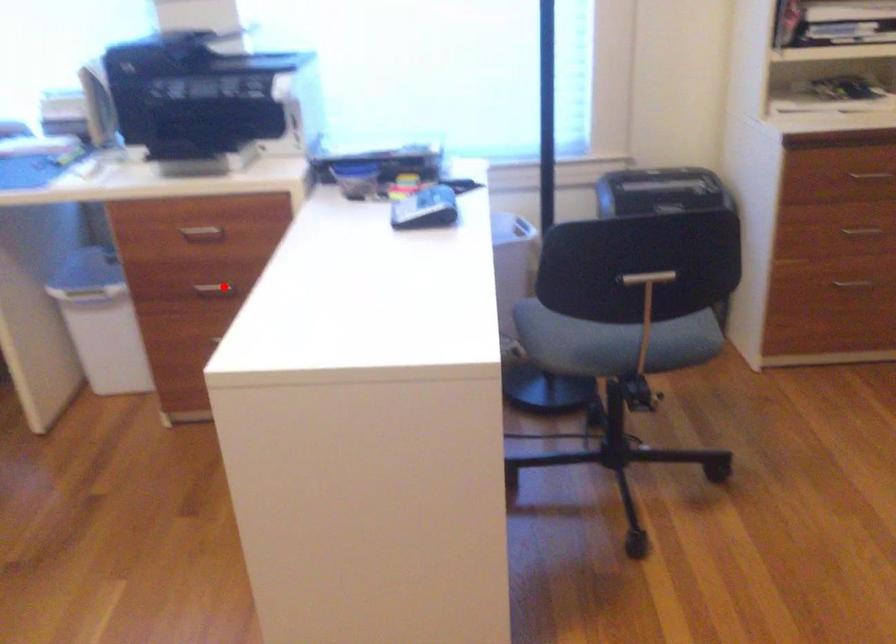
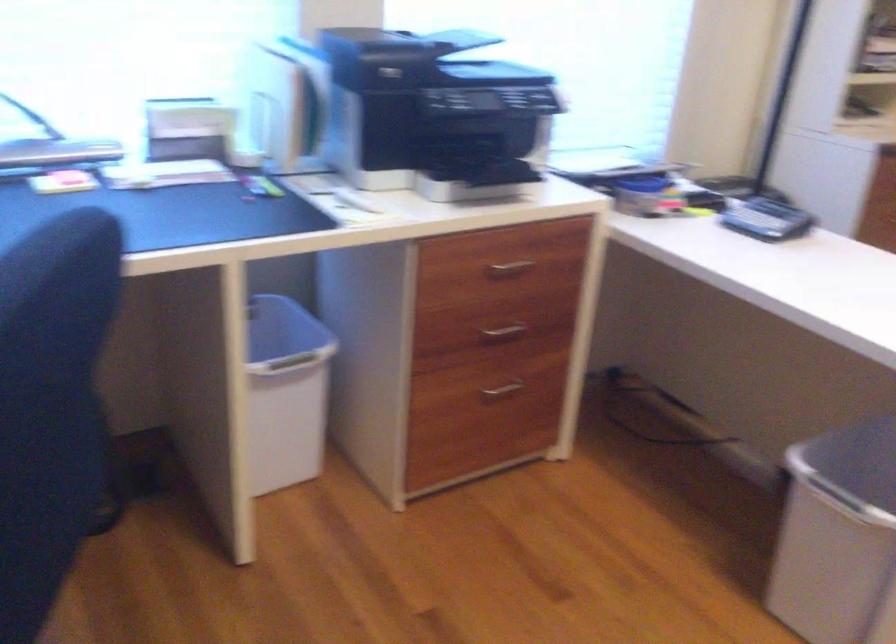
Where in the second image is the point corresponding to the highlighted location from the first image?

(503, 330)